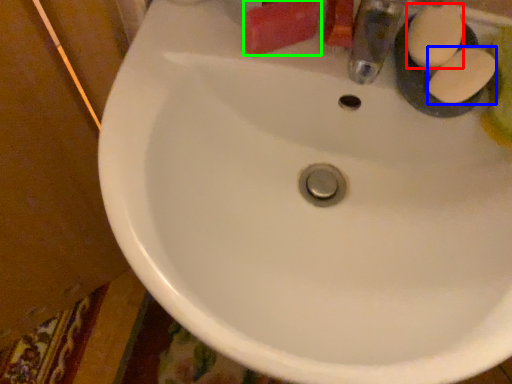
Question: Which object is the farthest from soap (highlighted by a red box)? Choose among these: soap (highlighted by a blue box) or soap (highlighted by a green box).

Choices:
 (A) soap
 (B) soap

Answer: (B)